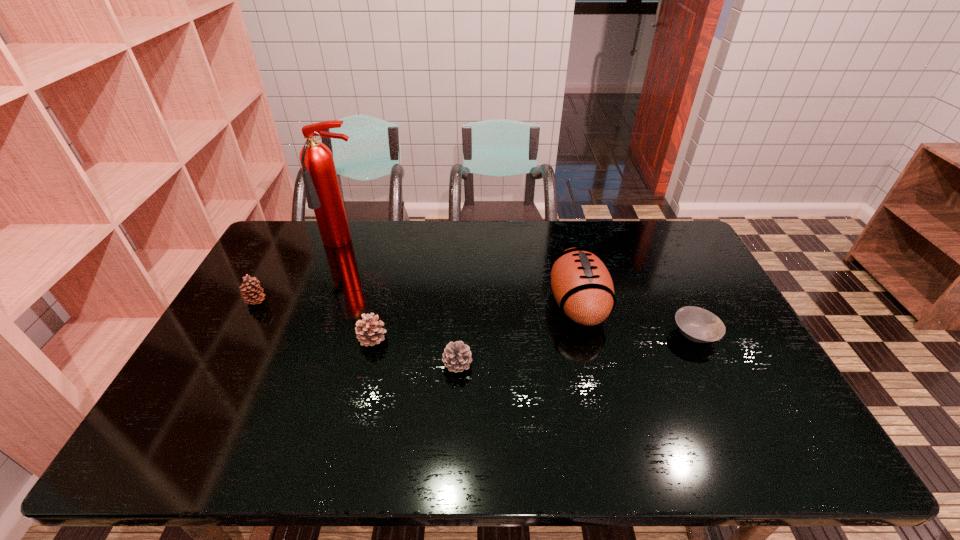
You are a GUI agent. You are given a task and a screenshot of the screen. Output one action in this format:
    pyautogui.click(x=<x>, y=<y>)
    Task: Click on the shortest object
    
    Given the screenshot: What is the action you would take?
    pyautogui.click(x=698, y=325)

Identify the location of bowl. The image size is (960, 540). (698, 325).

Where is `vacant region located 0.380m at the nozzle of the farthest object`? vacant region located 0.380m at the nozzle of the farthest object is located at coordinates 308,338.

You are a GUI agent. You are given a task and a screenshot of the screen. Output one action in this format:
    pyautogui.click(x=<x>, y=<y>)
    Task: Click on the vacant space situated 0.140m on the back of the football (American)
    Image resolution: width=960 pixels, height=540 pixels.
    Given the screenshot: What is the action you would take?
    pyautogui.click(x=564, y=247)

What are the coordinates of `vacant area situated 0.220m on the right of the leftmost object` in the screenshot? It's located at (338, 302).

This screenshot has width=960, height=540. I want to click on free region located 0.340m on the right of the second nearest pinecone, so click(x=507, y=338).

You are a GUI agent. You are given a task and a screenshot of the screen. Output one action in this format:
    pyautogui.click(x=<x>, y=<y>)
    Task: Click on the blank space located on the back of the third object from right to left
    The width and height of the screenshot is (960, 540).
    Given the screenshot: What is the action you would take?
    pyautogui.click(x=461, y=300)

This screenshot has width=960, height=540. Find the location of `free location located 0.180m on the left of the rightmost object`. free location located 0.180m on the left of the rightmost object is located at coordinates (609, 334).

Where is `object present at the far edge`? The image size is (960, 540). object present at the far edge is located at coordinates (323, 194).

Where is `object positioned at the left edge`? Image resolution: width=960 pixels, height=540 pixels. object positioned at the left edge is located at coordinates (252, 293).